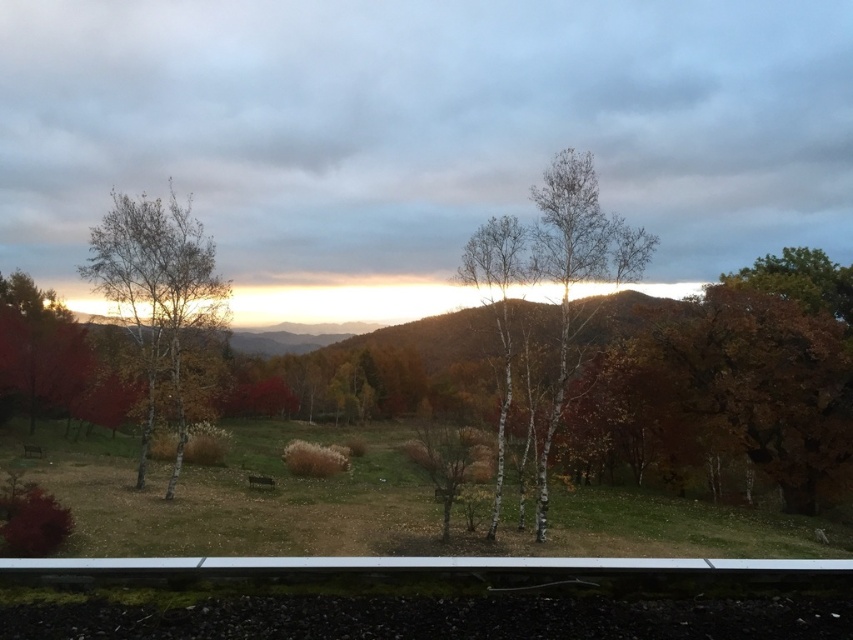
Does shiny red tree at left have a lesser height compared to white bark trees at center?

Incorrect, shiny red tree at left's height does not fall short of white bark trees at center's.

Does shiny red tree at left appear under white bark trees at center?

No, shiny red tree at left is not below white bark trees at center.

Looking at this image, who is more forward, (x=0, y=364) or (x=505, y=282)?

Positioned in front is point (x=505, y=282).

This screenshot has height=640, width=853. Identify the location of shiny red tree at left. (39, 348).

Between smooth white birch at left and shiny red tree at left, which one has more height?

smooth white birch at left is taller.

Who is more distant from viewer, (169,285) or (26,346)?

The point (26,346) is behind.

Locate an element on the screen. The image size is (853, 640). smooth white birch at left is located at coordinates (158, 296).

Is point (175, 353) positioned after point (500, 289)?

That is True.

Does smooth white birch at left come in front of white bark trees at center?

No, it is not.

Where is `smooth white birch at left`? smooth white birch at left is located at coordinates (158, 296).